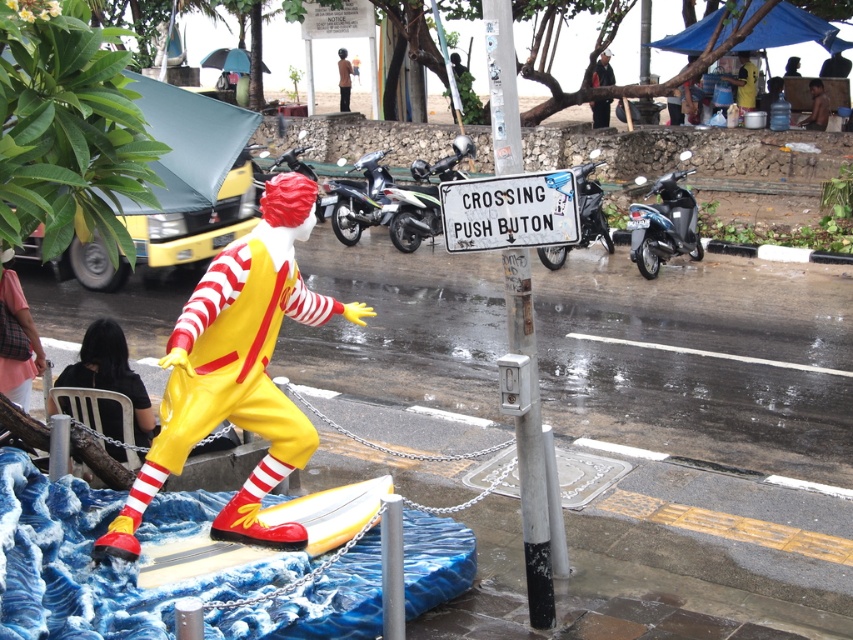
Can you confirm if metallic blue scooter at right is positioned to the right of white glossy motorcycle at center?

Yes, metallic blue scooter at right is to the right of white glossy motorcycle at center.

Which is more to the left, metallic blue scooter at right or white glossy motorcycle at center?

Positioned to the left is white glossy motorcycle at center.

Which is in front, point (691, 204) or point (433, 234)?

Point (691, 204) is more forward.

Locate an element on the screen. metallic blue scooter at right is located at coordinates (663, 225).

Can you confirm if black fabric person at lower left is taller than metallic blue scooter at right?

No, black fabric person at lower left is not taller than metallic blue scooter at right.

Between point (107, 424) and point (653, 234), which one is positioned in front?

Positioned in front is point (107, 424).

Where is `black fabric person at lower left`? Image resolution: width=853 pixels, height=640 pixels. black fabric person at lower left is located at coordinates (109, 372).

Which is below, metallic blue scooter at right or skinny man at upper right?

metallic blue scooter at right

Is metallic blue scooter at right shorter than skinny man at upper right?

No.

In order to click on metallic blue scooter at right in this screenshot , I will do `click(663, 225)`.